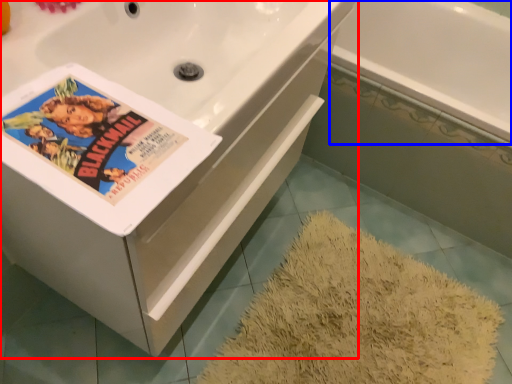
Question: Which object appears farthest to the camera in this image, bathtub (highlighted by a red box) or bath (highlighted by a blue box)?

Choices:
 (A) bathtub
 (B) bath

Answer: (B)